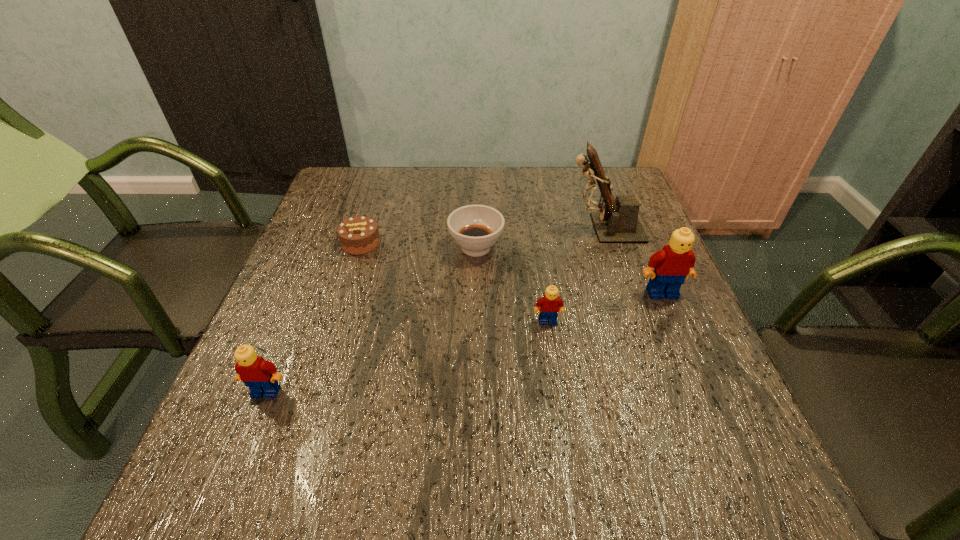
You are a GUI agent. You are given a task and a screenshot of the screen. Output one action in this format:
    pyautogui.click(x=<x>, y=<y>)
    Task: Click on the nearest object
    This screenshot has height=540, width=960.
    Given the screenshot: What is the action you would take?
    pyautogui.click(x=261, y=376)

I want to click on the nearest Lego, so click(x=261, y=376).

The image size is (960, 540). I want to click on the shortest Lego, so click(x=550, y=304).

The height and width of the screenshot is (540, 960). Find the location of `the second nearest Lego`. the second nearest Lego is located at coordinates (550, 304).

Where is `the rightmost Lego`? the rightmost Lego is located at coordinates (672, 264).

Locate an element on the screen. This screenshot has height=540, width=960. the fourth farthest object is located at coordinates (672, 264).

Where is `figurine`? The height and width of the screenshot is (540, 960). figurine is located at coordinates (617, 222).

In order to click on chocolate cake in this screenshot , I will do `click(358, 235)`.

Image resolution: width=960 pixels, height=540 pixels. In order to click on soup bowl in this screenshot , I will do `click(475, 228)`.

In order to click on vacant space located 0.070m on the front-facing side of the leftmost Lego in this screenshot , I will do `click(249, 435)`.